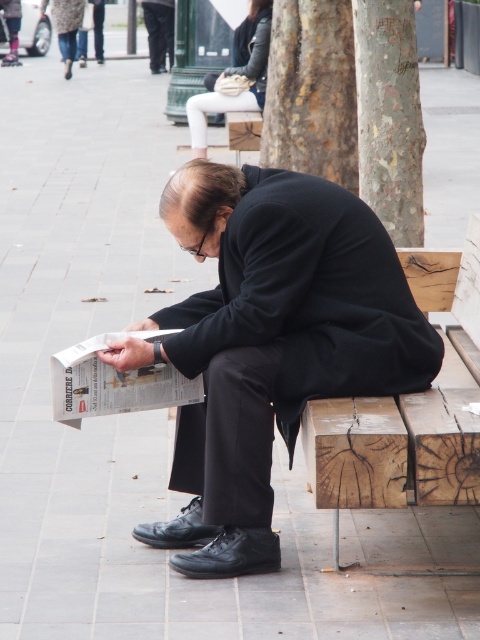
You are a pedestrian walking on the sidewalk and notice the smooth bark tree at upper right and the leather jacket at upper center. Which object is closer to the ground?

The smooth bark tree at upper right is positioned under the leather jacket at upper center, so the smooth bark tree at upper right is closer to the ground.

Based on the scene description, where is the smooth bark tree at upper right located in the image?

The smooth bark tree at upper right is located at point [389,116].